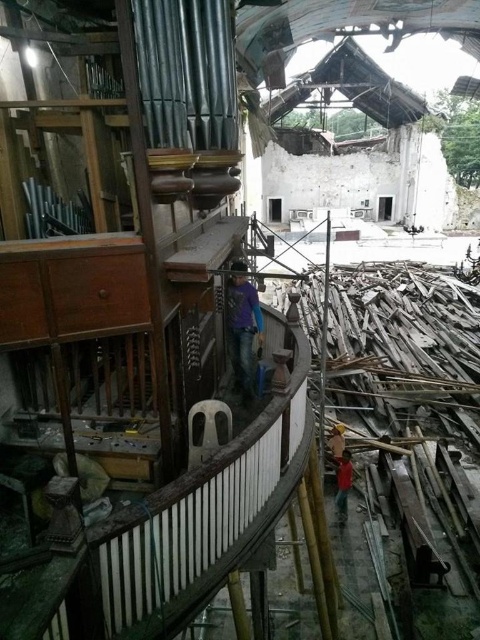
Can you confirm if red matte shirt at lower right is positioned below yellow hard hat at center?

Yes, red matte shirt at lower right is below yellow hard hat at center.

Looking at this image, is red matte shirt at lower right shorter than yellow hard hat at center?

In fact, red matte shirt at lower right may be taller than yellow hard hat at center.

Find the location of `red matte shirt at lower right`. red matte shirt at lower right is located at coordinates coord(343,484).

Does purple matte shirt at center have a lesser height compared to red matte shirt at lower right?

In fact, purple matte shirt at center may be taller than red matte shirt at lower right.

Is point (247, 342) closer to camera compared to point (345, 484)?

Yes, point (247, 342) is closer to viewer.

Does point (240, 312) come in front of point (344, 481)?

Yes, it is in front of point (344, 481).

Locate an element on the screen. This screenshot has width=480, height=640. purple matte shirt at center is located at coordinates (241, 326).

Is point (252, 292) in front of point (337, 428)?

Yes, point (252, 292) is in front of point (337, 428).

Find the location of a particular element. purple matte shirt at center is located at coordinates [x=241, y=326].